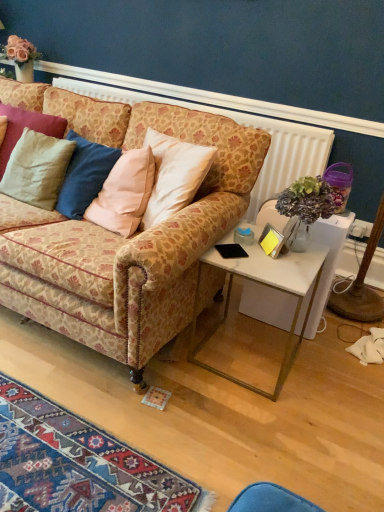
I want to click on free space in front of white marble desk at right, so click(317, 362).